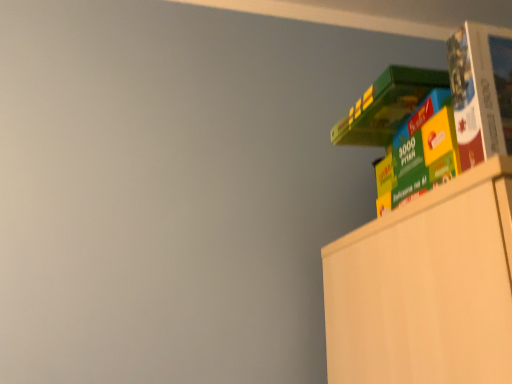
Question: Should I look upward or downward to see hardcover book at upper right?

Choices:
 (A) down
 (B) up

Answer: (B)